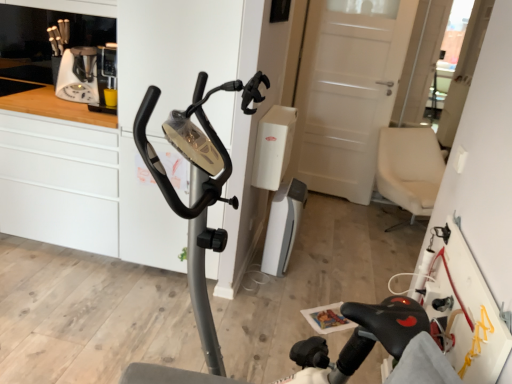
Locate an element on the screen. The width and height of the screenshot is (512, 384). vacant space in front of white plastic vacuum cleaner at center is located at coordinates (287, 283).